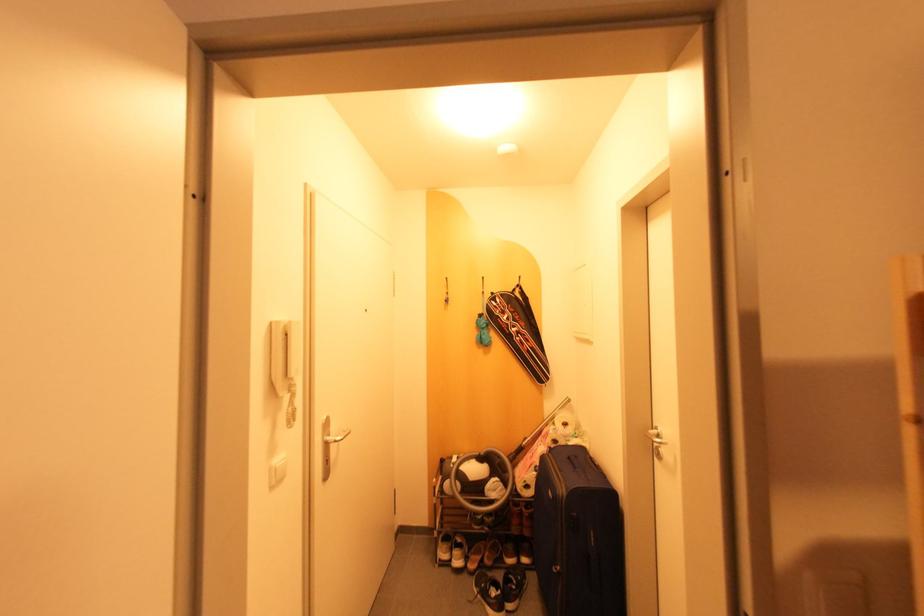
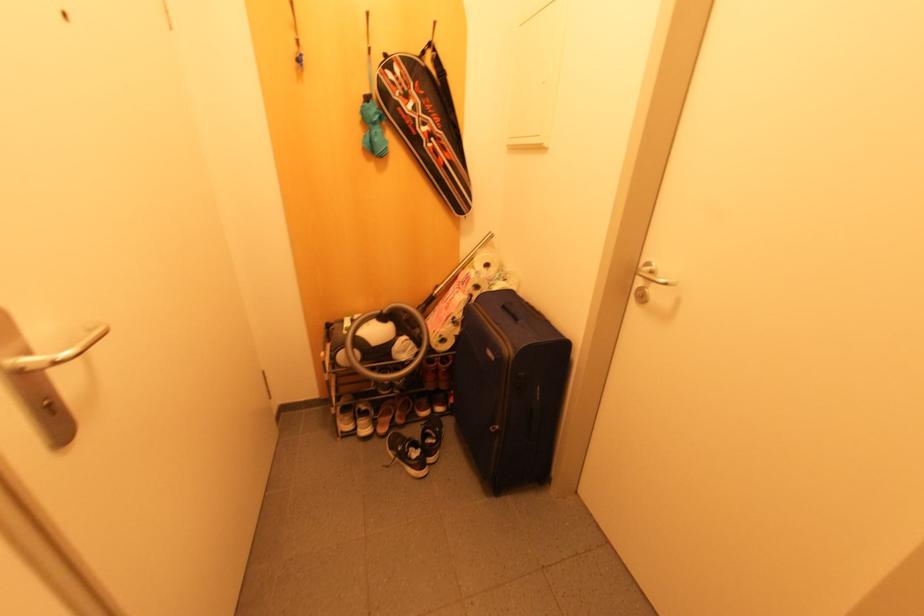
The first image is from the beginning of the video and the second image is from the end. How did the camera likely rotate when shooting the video?

The camera's rotation is toward right-down.